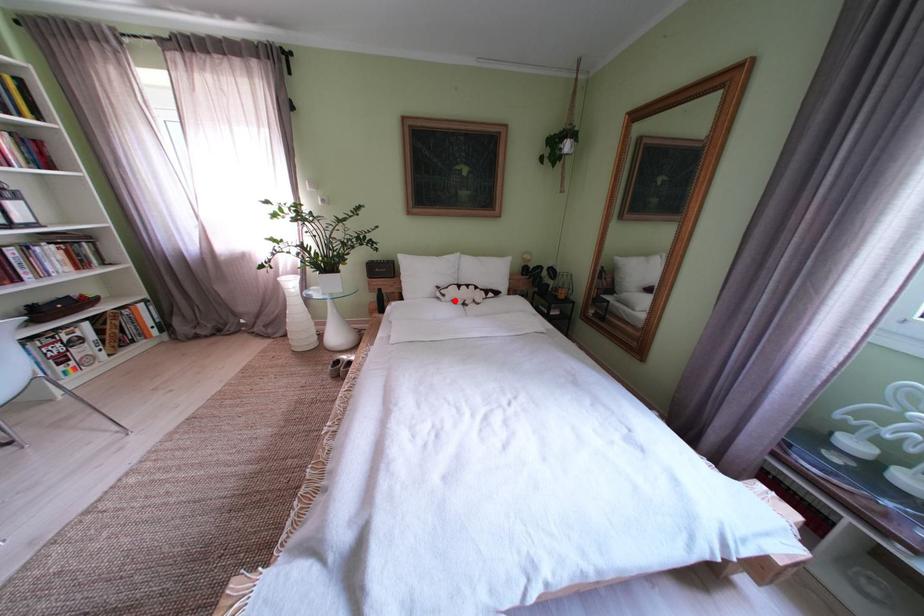
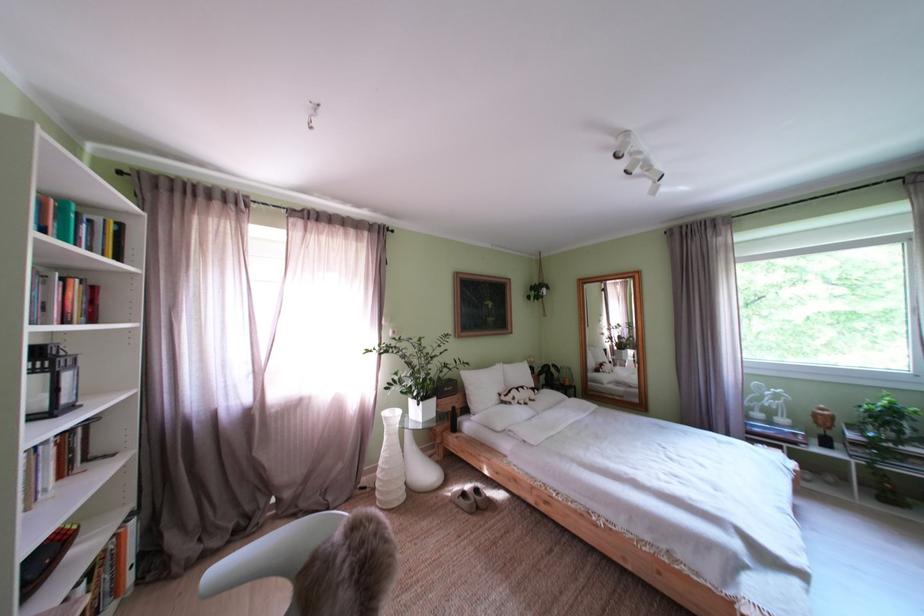
Where in the second image is the point corresponding to the highlighted location from the first image?

(525, 405)